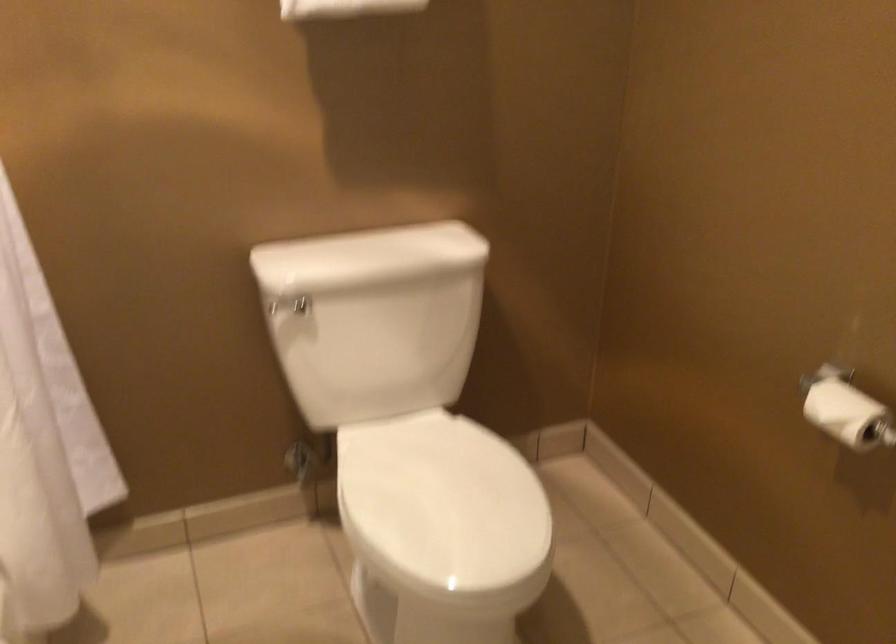
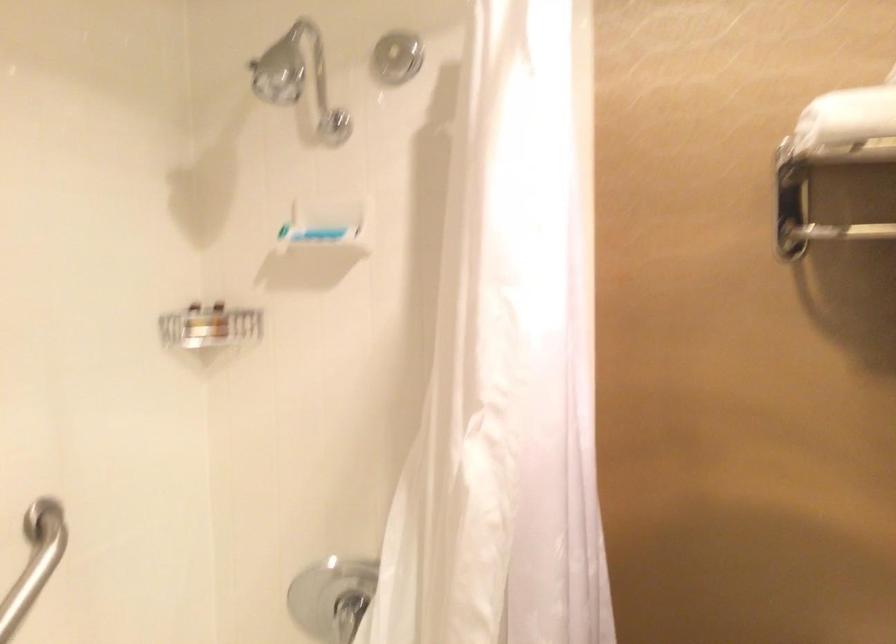
In the scene shown: First-person continuous shooting, in which direction is the camera rotating?

The rotation direction of the camera is left-up.